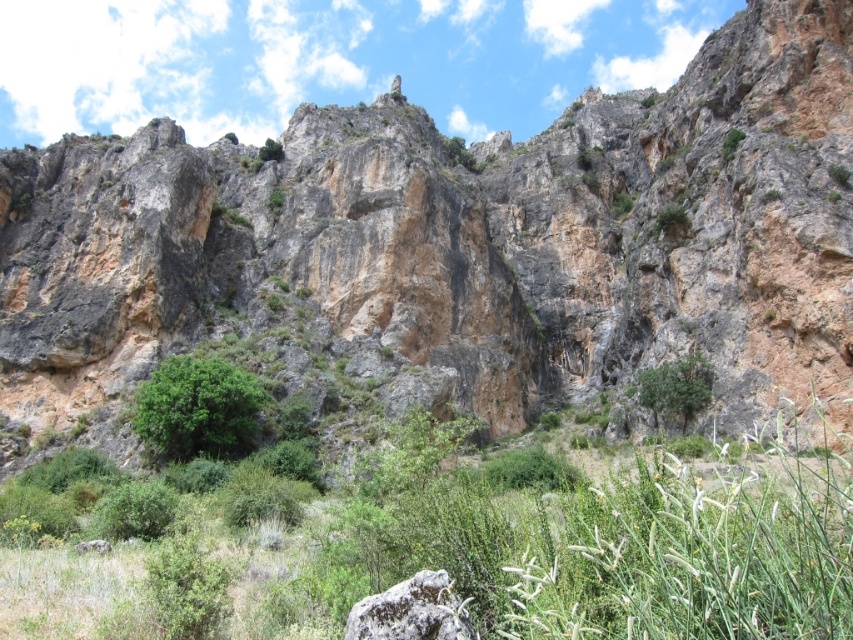
Which of these two, green leafy bush at center or rough textured rock at center, stands shorter?

With less height is rough textured rock at center.

I want to click on green leafy bush at center, so click(x=198, y=410).

The image size is (853, 640). What are the coordinates of `green leafy bush at center` in the screenshot? It's located at (198, 410).

Who is taller, green leafy bush at center or green leafy shrub at center-right?

green leafy bush at center

The image size is (853, 640). In order to click on green leafy bush at center in this screenshot , I will do `click(198, 410)`.

The image size is (853, 640). I want to click on green leafy bush at center, so pyautogui.click(x=198, y=410).

Who is lower down, rough textured rock at center or green leafy shrub at center-right?

rough textured rock at center is below.

Who is more forward, (451, 632) or (654, 371)?

Point (451, 632) is more forward.

Is point (419, 604) closer to viewer compared to point (682, 417)?

Yes, point (419, 604) is in front of point (682, 417).

I want to click on rough textured rock at center, so point(410,611).